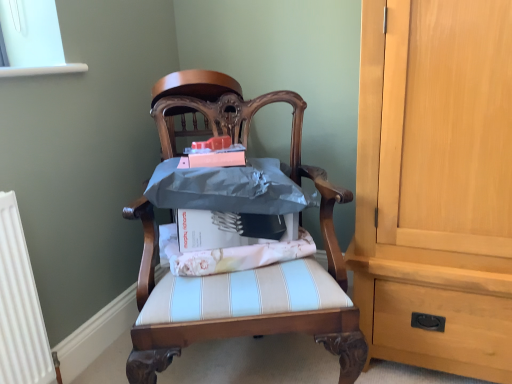
Question: Is metallic blue cushion at center, the 1th chair in the top-to-bottom sequence, located within wooden chair at center, which appears as the first chair when ordered from the bottom?

Choices:
 (A) yes
 (B) no

Answer: (B)

Question: Is there a large distance between wooden chair at center, which appears as the first chair when ordered from the bottom, and metallic blue cushion at center, the 1th chair in the top-to-bottom sequence?

Choices:
 (A) no
 (B) yes

Answer: (A)

Question: From a real-world perspective, does wooden chair at center, which appears as the first chair when ordered from the bottom, sit lower than metallic blue cushion at center, which is the second chair from bottom to top?

Choices:
 (A) yes
 (B) no

Answer: (A)

Question: Is wooden chair at center, which is the second chair in top-to-bottom order, beside metallic blue cushion at center, the 1th chair in the top-to-bottom sequence?

Choices:
 (A) yes
 (B) no

Answer: (B)

Question: From a real-world perspective, is wooden chair at center, which is the second chair in top-to-bottom order, over metallic blue cushion at center, the 1th chair in the top-to-bottom sequence?

Choices:
 (A) yes
 (B) no

Answer: (B)

Question: Is white striped fabric at center in front of or behind wooden chair at center, which appears as the first chair when ordered from the bottom, in the image?

Choices:
 (A) behind
 (B) front

Answer: (A)

Question: From a real-world perspective, is white striped fabric at center above or below wooden chair at center, which is the second chair in top-to-bottom order?

Choices:
 (A) above
 (B) below

Answer: (A)

Question: Considering the positions of white striped fabric at center and wooden chair at center, which appears as the first chair when ordered from the bottom, in the image, is white striped fabric at center wider or thinner than wooden chair at center, which appears as the first chair when ordered from the bottom,?

Choices:
 (A) thin
 (B) wide

Answer: (A)

Question: Is white striped fabric at center situated inside wooden chair at center, which is the second chair in top-to-bottom order, or outside?

Choices:
 (A) outside
 (B) inside

Answer: (B)

Question: Is wooden chair at center, which appears as the first chair when ordered from the bottom, bigger or smaller than metallic blue cushion at center, which is the second chair from bottom to top?

Choices:
 (A) small
 (B) big

Answer: (B)

Question: Is wooden chair at center, which is the second chair in top-to-bottom order, situated inside metallic blue cushion at center, the 1th chair in the top-to-bottom sequence, or outside?

Choices:
 (A) outside
 (B) inside

Answer: (A)

Question: In the image, is wooden chair at center, which is the second chair in top-to-bottom order, on the left side or the right side of metallic blue cushion at center, the 1th chair in the top-to-bottom sequence?

Choices:
 (A) right
 (B) left

Answer: (A)

Question: Looking at their shapes, would you say wooden chair at center, which is the second chair in top-to-bottom order, is wider or thinner than metallic blue cushion at center, the 1th chair in the top-to-bottom sequence?

Choices:
 (A) wide
 (B) thin

Answer: (A)

Question: Considering the positions of wooden chair at center, which is the second chair in top-to-bottom order, and white striped fabric at center in the image, is wooden chair at center, which is the second chair in top-to-bottom order, wider or thinner than white striped fabric at center?

Choices:
 (A) thin
 (B) wide

Answer: (B)

Question: Considering the relative positions of wooden chair at center, which is the second chair in top-to-bottom order, and white striped fabric at center in the image provided, is wooden chair at center, which is the second chair in top-to-bottom order, to the left or to the right of white striped fabric at center?

Choices:
 (A) left
 (B) right

Answer: (B)